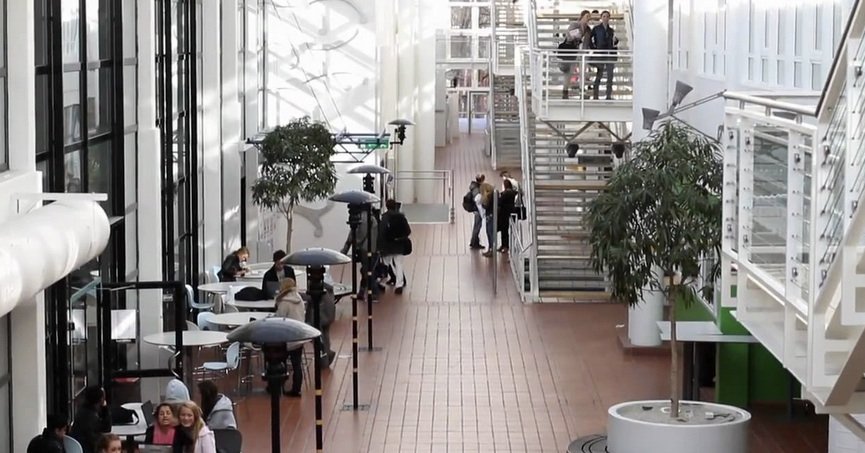
Locate an element on the screen. plant container is located at coordinates (639, 433).